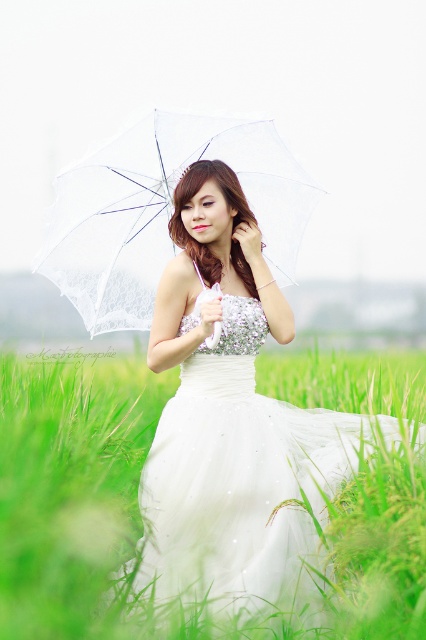
You are a photographer positioned at the origin point of the coordinate system. The white satin dress at center is at point (233, 422). If you want to take a photo of the white satin dress at center from a distance of 0.3 units, which direction should you move? Please provide the direction as a coordinate point relative to the dress.

To take a photo of the white satin dress at center from a distance of 0.3 units, you should move to the point 0.361, 0.549. This is directly to the left along the x axis by subtracting 0.3 from the dress position at (233, 422).

You are a photographer positioned at the camera. You want to capture a closeup shot of the white satin dress at center. Considering your current distance, do you need to move closer or farther away to achieve this?

The white satin dress at center is 3.49 meters away from the camera. To capture a closeup shot, you need to move closer to reduce the distance between the camera and the dress.

You are a photographer planning to capture a closeup of the white satin dress at center and the transparent fabric umbrella at center. Given that the camera can only focus on one object at a time, which object should you adjust the focus to first if you want to ensure the wider object is in sharp detail?

The white satin dress at center has a larger width than the transparent fabric umbrella at center, so you should adjust the focus to the white satin dress at center first to ensure its wider dimensions are captured sharply.